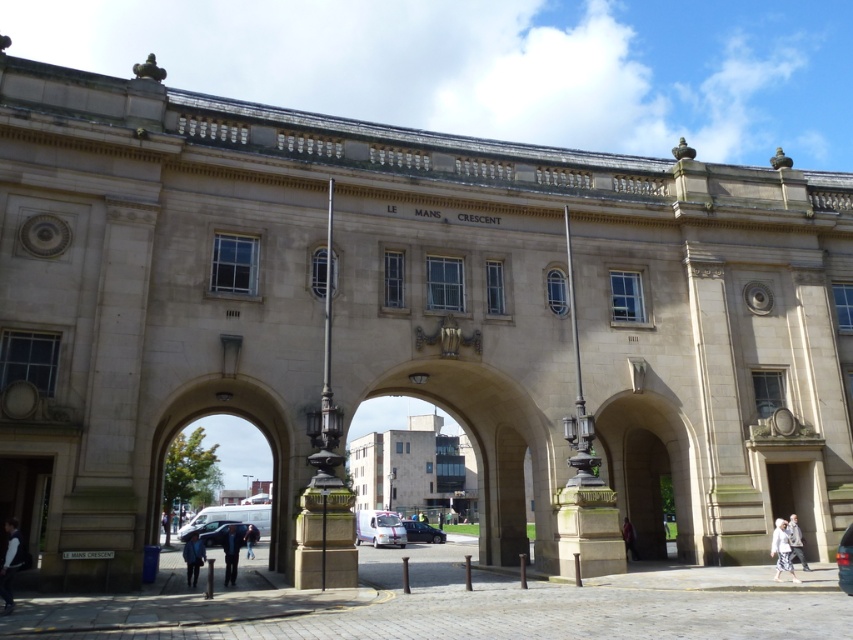
Question: Which point is closer to the camera?

Choices:
 (A) matte gray door at lower left
 (B) dark blue fabric jacket at lower left
 (C) beige stone archway at center

Answer: (A)

Question: Can you confirm if matte stone archway at center is positioned to the left of white fabric at lower right?

Choices:
 (A) yes
 (B) no

Answer: (A)

Question: Does white concrete building at center lie behind dark blue jacket at lower right?

Choices:
 (A) yes
 (B) no

Answer: (A)

Question: In this image, where is beige stone archway at center located relative to white concrete building at center?

Choices:
 (A) below
 (B) above

Answer: (B)

Question: Which point is farther from the camera taking this photo?

Choices:
 (A) (21, 548)
 (B) (403, 500)

Answer: (B)

Question: Which point is farther to the camera?

Choices:
 (A) beige stone archway at center
 (B) dark blue jeans at center

Answer: (B)